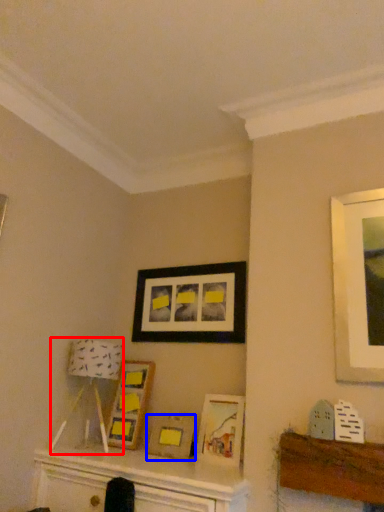
Question: Which of the following is the closest to the observer, lamp (highlighted by a red box) or picture frame (highlighted by a blue box)?

Choices:
 (A) lamp
 (B) picture frame

Answer: (A)